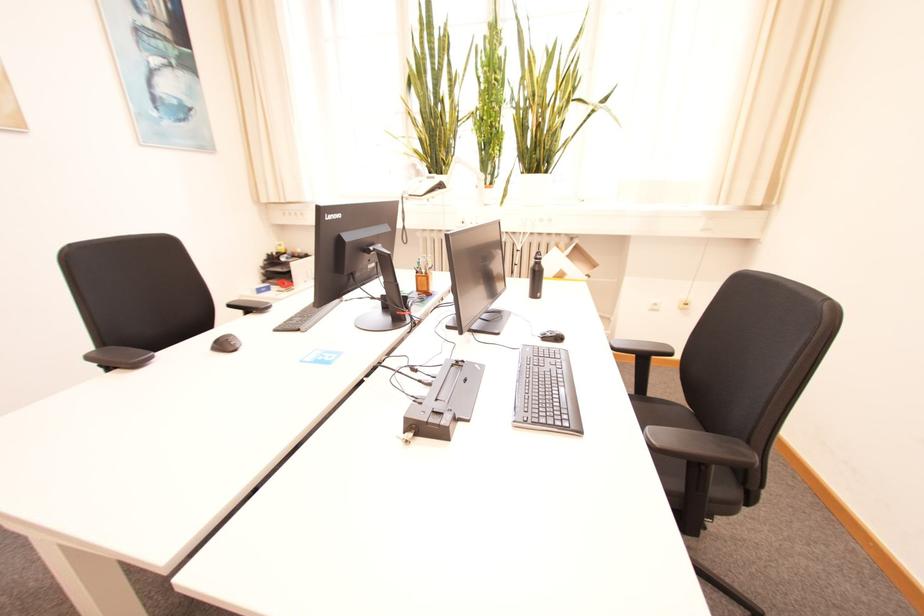
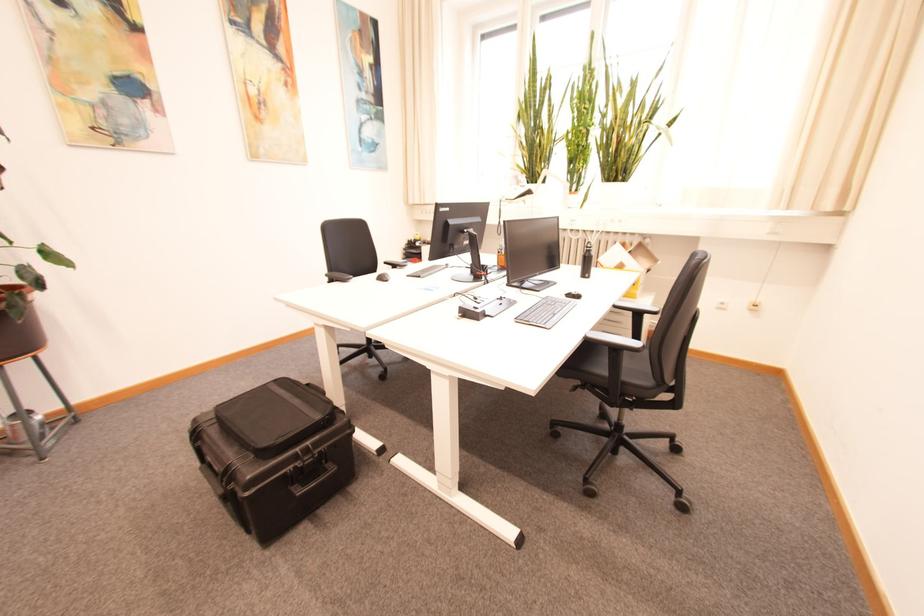
Where in the second image is the point corresponding to pixel 572 341 from the first image?

(589, 299)